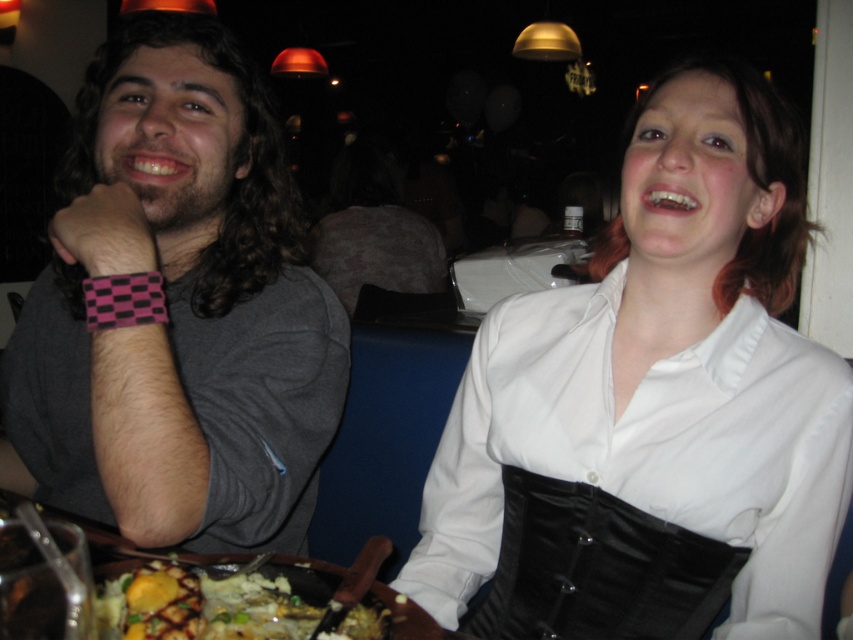
Question: Estimate the real-world distances between objects in this image. Which object is farther from the golden mashed potatoes at lower center?

Choices:
 (A) black velvet corset at center
 (B) wooden table at lower center
 (C) gray matte shirt at left
 (D) white matte shirt at upper right

Answer: (D)

Question: Which is nearer to the wooden table at lower center?

Choices:
 (A) golden mashed potatoes at lower center
 (B) white matte shirt at upper right
 (C) black velvet corset at center

Answer: (A)

Question: Is white matte shirt at upper right bigger than wooden table at lower center?

Choices:
 (A) no
 (B) yes

Answer: (B)

Question: Which object is positioned closest to the gray matte shirt at left?

Choices:
 (A) white matte shirt at upper right
 (B) golden mashed potatoes at lower center
 (C) wooden table at lower center
 (D) black velvet corset at center

Answer: (C)

Question: Is black velvet corset at center to the right of golden mashed potatoes at lower center from the viewer's perspective?

Choices:
 (A) no
 (B) yes

Answer: (B)

Question: From the image, what is the correct spatial relationship of white matte shirt at upper right in relation to gray matte shirt at left?

Choices:
 (A) above
 (B) below

Answer: (B)